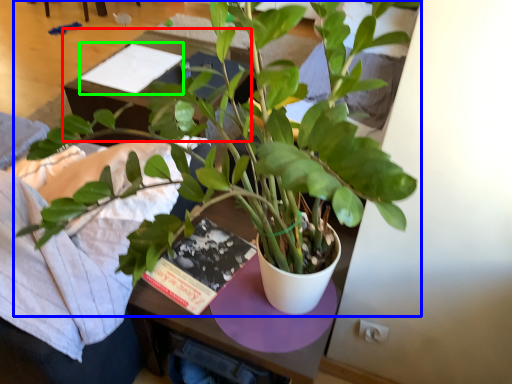
Question: Estimate the real-world distances between objects in this image. Which object is closer to table (highlighted by a red box), houseplant (highlighted by a blue box) or book (highlighted by a green box)?

Choices:
 (A) houseplant
 (B) book

Answer: (B)